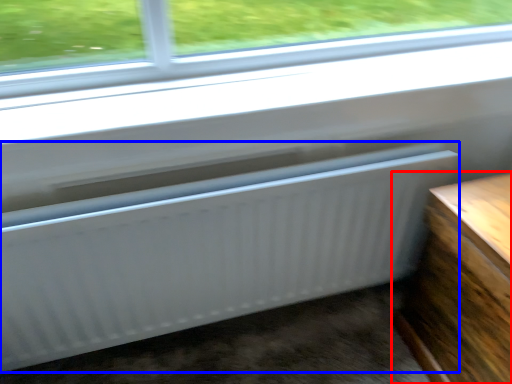
Question: Among these objects, which one is farthest to the camera, furniture (highlighted by a red box) or radiator (highlighted by a blue box)?

Choices:
 (A) furniture
 (B) radiator

Answer: (B)